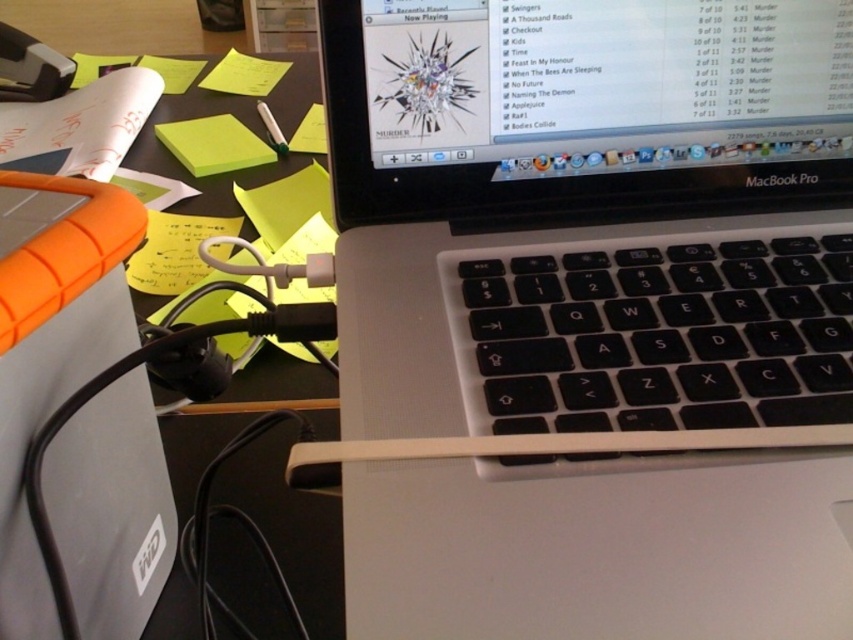
Question: Which object appears closest to the camera in this image?

Choices:
 (A) green matte pen at upper center
 (B) yellow paper at upper left

Answer: (A)

Question: Among these points, which one is farthest from the camera?

Choices:
 (A) (274, 129)
 (B) (241, 92)
 (C) (0, 596)
 (D) (173, 280)

Answer: (B)

Question: Which object is farther from the camera taking this photo?

Choices:
 (A) yellow paper at lower left
 (B) yellow paper at upper left

Answer: (B)

Question: Does orange rubberized hard drive at lower left have a smaller size compared to green matte sticky note at upper left?

Choices:
 (A) yes
 (B) no

Answer: (B)

Question: Does yellow paper at lower left come in front of yellow paper at upper left?

Choices:
 (A) yes
 (B) no

Answer: (A)

Question: Is orange rubberized hard drive at lower left above green matte pen at upper center?

Choices:
 (A) yes
 (B) no

Answer: (B)